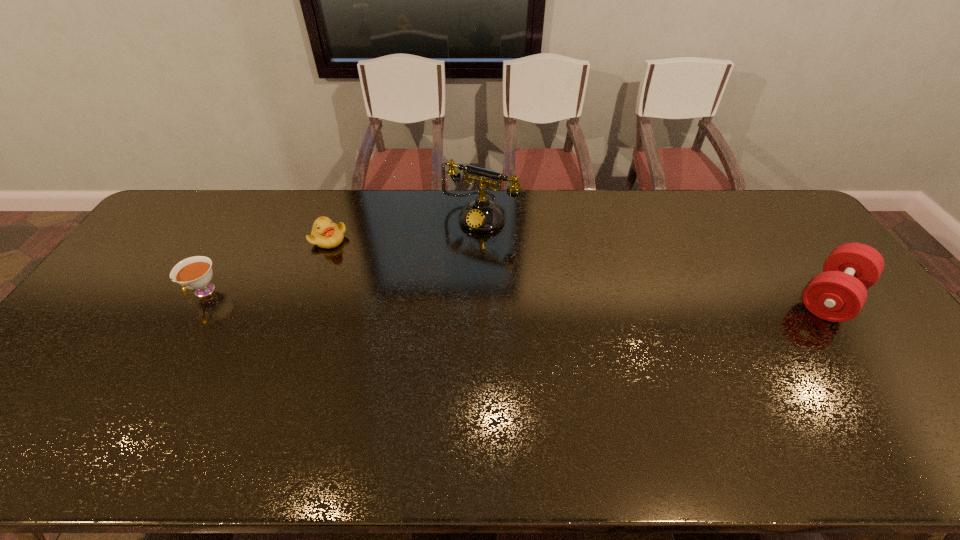
Where is `vacant space at the right edge of the desktop`? vacant space at the right edge of the desktop is located at coordinates (884, 349).

Locate an element on the screen. vacant space at the near right corner of the desktop is located at coordinates (883, 406).

Where is `vacant area that lies between the duckling and the tallest object`? The width and height of the screenshot is (960, 540). vacant area that lies between the duckling and the tallest object is located at coordinates coord(404,227).

Identify the location of unoccupied area between the telephone and the second object from left to right. (404, 227).

Locate an element on the screen. The image size is (960, 540). blank region between the third object from right to left and the teacup is located at coordinates (266, 266).

Locate an element on the screen. The image size is (960, 540). empty space between the leftmost object and the second object from left to right is located at coordinates (266, 266).

Identify the location of free space between the duckling and the tallest object. (404, 227).

I want to click on empty location between the third object from right to left and the dumbbell, so click(580, 268).

At what (x,y) coordinates should I click in order to perform the action: click on vacant region between the duckling and the telephone. Please return your answer as a coordinate pair (x, y). The width and height of the screenshot is (960, 540). Looking at the image, I should click on (404, 227).

This screenshot has width=960, height=540. What are the coordinates of `free spot between the leftmost object and the rightmost object` in the screenshot? It's located at pyautogui.click(x=517, y=294).